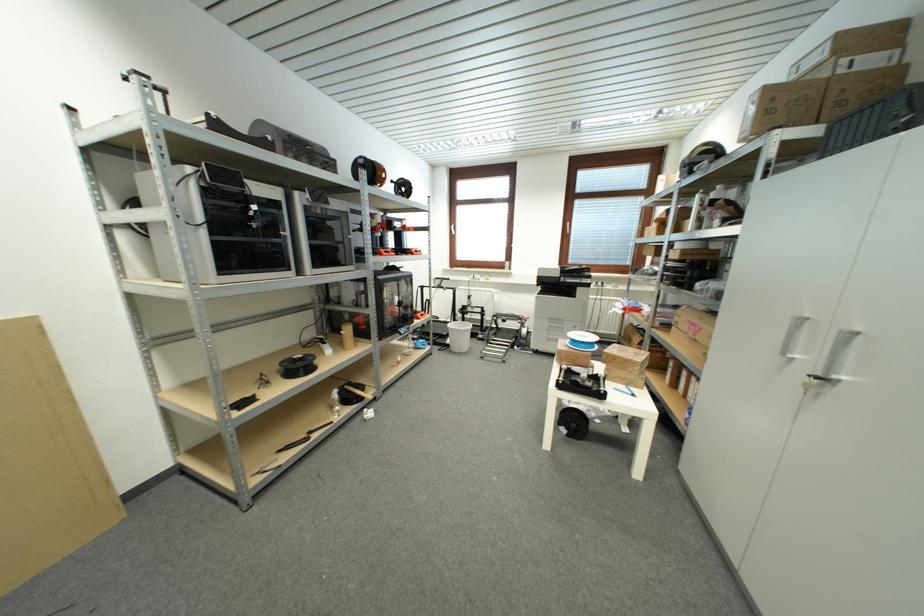
What do you see at coordinates (580, 382) in the screenshot?
I see `a printer scanner lid` at bounding box center [580, 382].